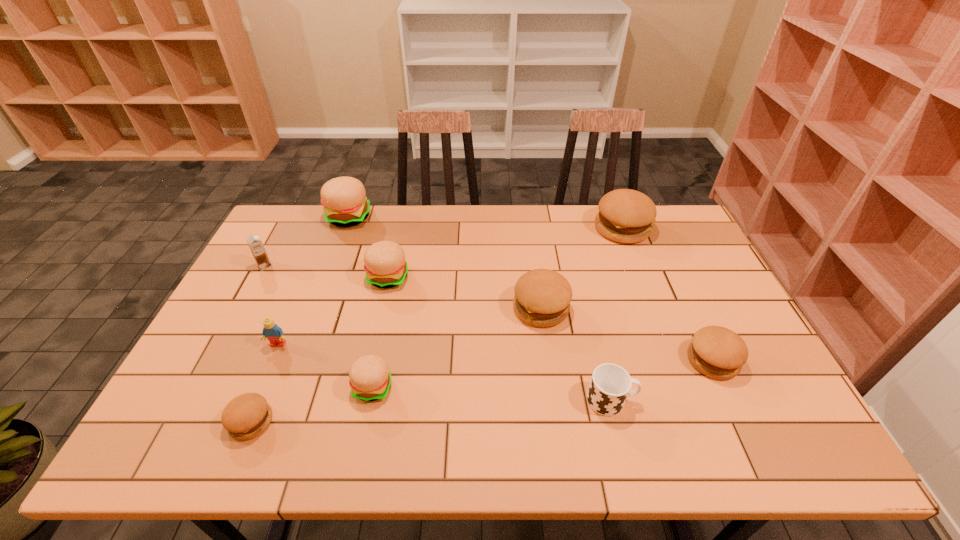
Identify the location of beige hamburger that can be found as the second closest to the Lego. The image size is (960, 540). [384, 262].

Image resolution: width=960 pixels, height=540 pixels. I want to click on brown hamburger that is the closest to the smallest beige hamburger, so click(x=246, y=416).

Choose which brown hamburger is the second nearest neighbor to the leftmost beige hamburger. Please provide its 2D coordinates. Your answer should be formatted as a tuple, i.e. [(x, y)], where the tuple contains the x and y coordinates of a point satisfying the conditions above.

[(246, 416)]

You are a GUI agent. You are given a task and a screenshot of the screen. Output one action in this format:
    pyautogui.click(x=<x>, y=<y>)
    Task: Click on the free location that satisfies the following two spatial constraints: 1. on the back side of the nearest beige hamburger; 2. on the right side of the third smallest brown hamburger
    
    Given the screenshot: What is the action you would take?
    pos(389,308)

Where is `free space that satisfies the following two spatial constraints: 1. on the front side of the second smallest brown hamburger; 2. on the side of the black cup with the handle`? free space that satisfies the following two spatial constraints: 1. on the front side of the second smallest brown hamburger; 2. on the side of the black cup with the handle is located at coordinates (732, 400).